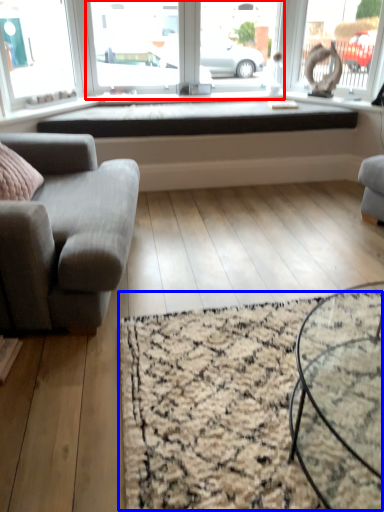
Question: Which point is closer to the camera, window screen (highlighted by a red box) or mat (highlighted by a blue box)?

Choices:
 (A) window screen
 (B) mat

Answer: (B)